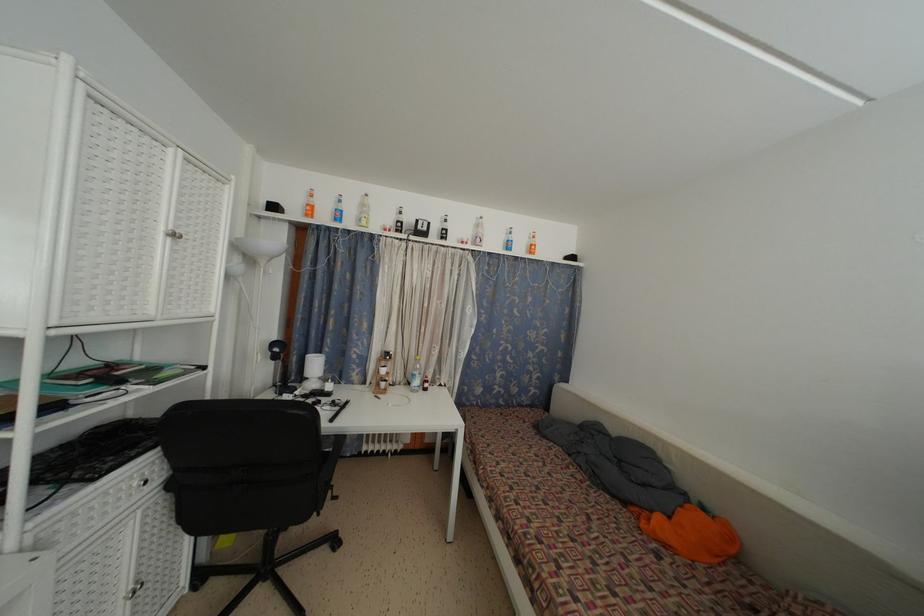
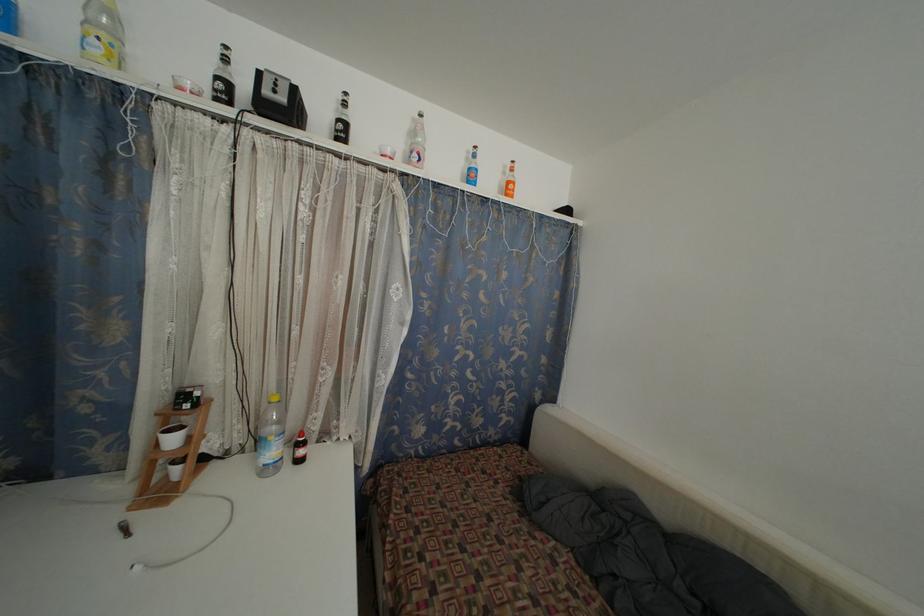
In the second image, find the point that corresponds to point (511, 238) in the first image.

(470, 164)